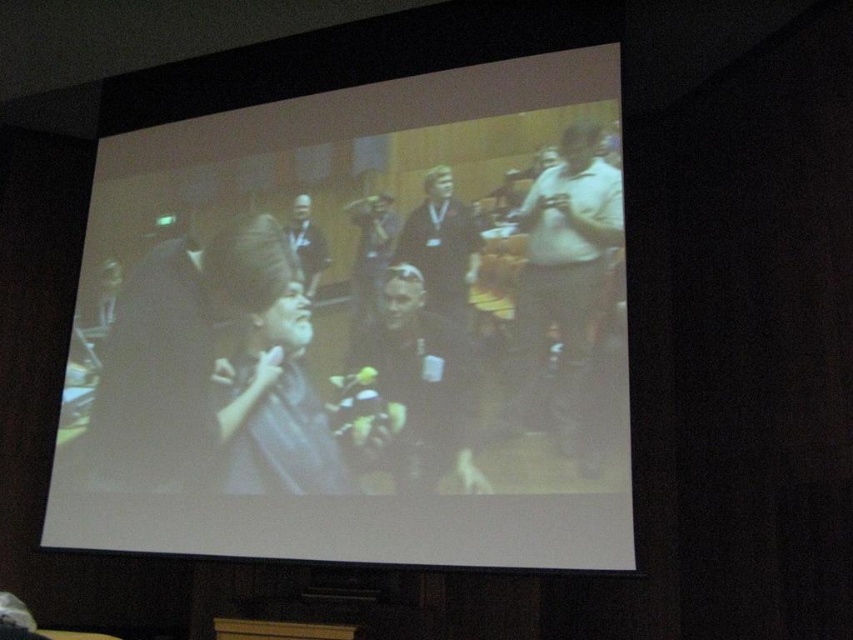
Between matte black shirt at center and dark gray suit at center, which one has more height?

matte black shirt at center is taller.

Is matte black shirt at center bigger than dark gray suit at center?

Yes, matte black shirt at center is bigger than dark gray suit at center.

Describe the element at coordinates (270, 369) in the screenshot. The image size is (853, 640). I see `matte black shirt at center` at that location.

Locate an element on the screen. The image size is (853, 640). matte black shirt at center is located at coordinates (270, 369).

Is matte black laptop at center positioned at the back of matte black shirt at center?

No, matte black laptop at center is in front of matte black shirt at center.

Measure the distance between point (x=572, y=256) and camera.

Point (x=572, y=256) is 3.46 meters from camera.

Image resolution: width=853 pixels, height=640 pixels. In order to click on matte black laptop at center in this screenshot , I will do `click(352, 332)`.

Is dark gray shirt at center positioned before matte black shirt at center?

No, it is not.

Between point (267, 244) and point (259, 234), which one is positioned in front?

Point (267, 244) is in front.

I want to click on dark gray shirt at center, so click(x=183, y=356).